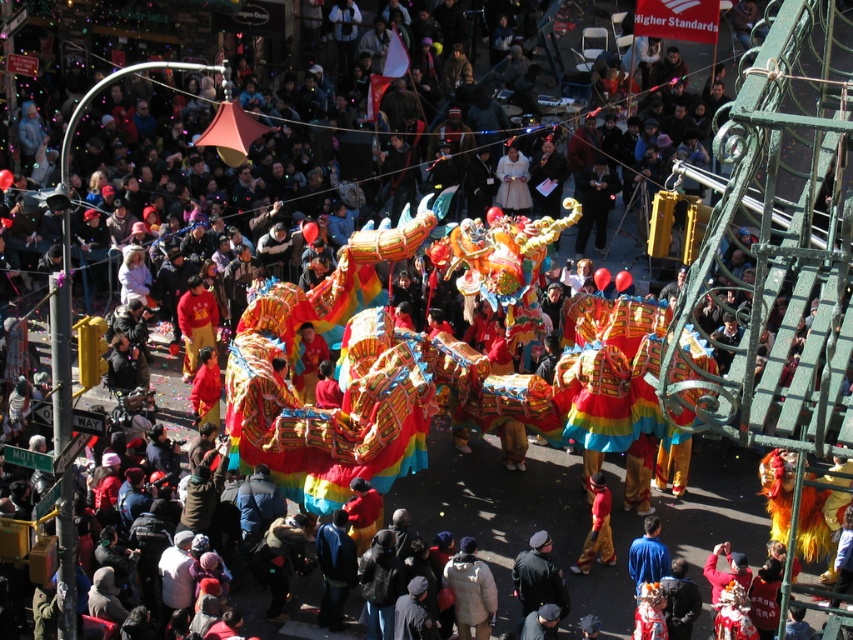
You are a photographer at the parade and want to capture a photo that includes both the dark blue uniform at center and the red fabric pants at lower center. However, you can only focus on one subject. Which subject should you focus on to ensure both are visible in the frame?

The dark blue uniform at center is in front of the red fabric pants at lower center, so focusing on the dark blue uniform at center will ensure both are visible in the frame.